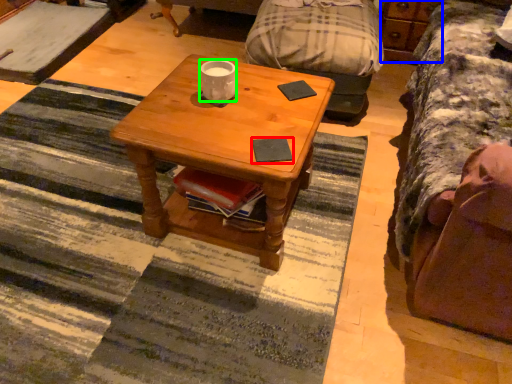
Question: Based on their relative distances, which object is nearer to pad (highlighted by a red box)? Choose from dresser (highlighted by a blue box) and coffee cup (highlighted by a green box).

Choices:
 (A) dresser
 (B) coffee cup

Answer: (B)